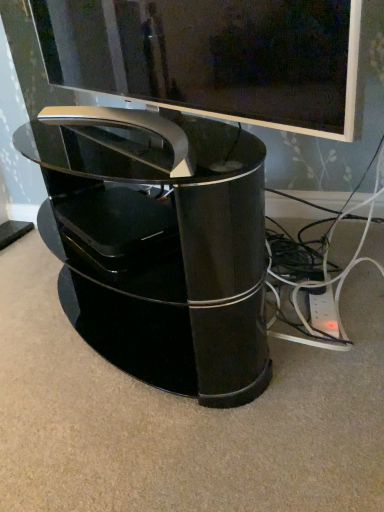
Question: Is glossy black tv stand at center taller than glossy black tv at upper center?

Choices:
 (A) no
 (B) yes

Answer: (B)

Question: Is glossy black tv stand at center outside glossy black tv at upper center?

Choices:
 (A) yes
 (B) no

Answer: (A)

Question: Considering the relative positions of glossy black tv stand at center and glossy black tv at upper center in the image provided, is glossy black tv stand at center to the right of glossy black tv at upper center from the viewer's perspective?

Choices:
 (A) no
 (B) yes

Answer: (B)

Question: Can you confirm if glossy black tv stand at center is positioned to the left of glossy black tv at upper center?

Choices:
 (A) no
 (B) yes

Answer: (A)

Question: Is glossy black tv stand at center not close to glossy black tv at upper center?

Choices:
 (A) no
 (B) yes

Answer: (A)

Question: Would you say glossy black tv at upper center is part of glossy black tv stand at center's contents?

Choices:
 (A) yes
 (B) no

Answer: (B)

Question: Does glossy black tv at upper center have a greater height compared to glossy black tv stand at center?

Choices:
 (A) yes
 (B) no

Answer: (B)

Question: Is glossy black tv at upper center facing towards glossy black tv stand at center?

Choices:
 (A) no
 (B) yes

Answer: (A)

Question: Considering the relative positions of glossy black tv at upper center and glossy black tv stand at center in the image provided, is glossy black tv at upper center to the left of glossy black tv stand at center from the viewer's perspective?

Choices:
 (A) yes
 (B) no

Answer: (A)

Question: Is glossy black tv at upper center facing away from glossy black tv stand at center?

Choices:
 (A) no
 (B) yes

Answer: (A)

Question: From a real-world perspective, is glossy black tv at upper center on glossy black tv stand at center?

Choices:
 (A) no
 (B) yes

Answer: (B)

Question: Is glossy black tv at upper center shorter than glossy black tv stand at center?

Choices:
 (A) no
 (B) yes

Answer: (B)

Question: Does point (187, 23) appear closer or farther from the camera than point (49, 137)?

Choices:
 (A) farther
 (B) closer

Answer: (B)